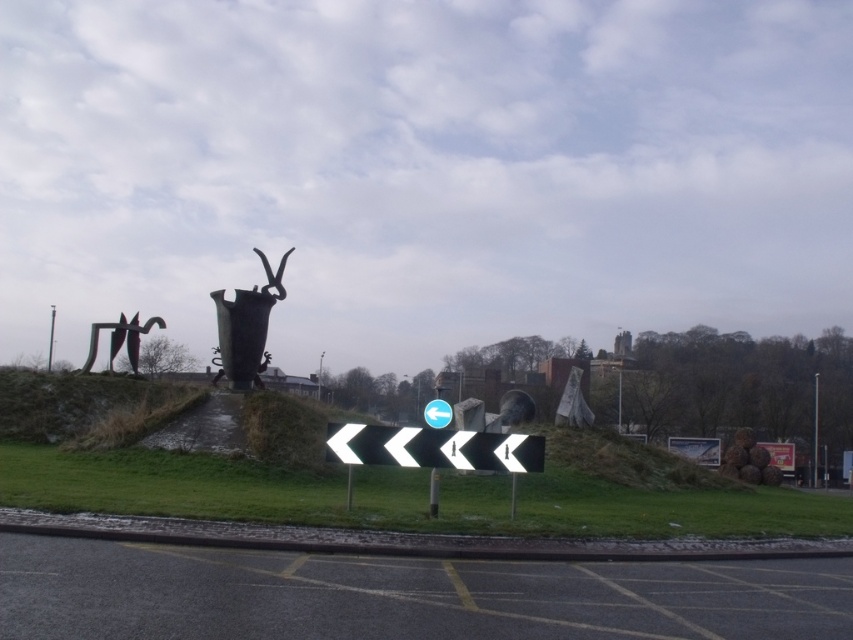
Question: Considering the real-world distances, which object is closest to the metallic pole at left?

Choices:
 (A) polished bronze vase at center
 (B) polished bronze statue at center

Answer: (A)

Question: Can you confirm if white plastic arrow at center is thinner than metallic pole at left?

Choices:
 (A) no
 (B) yes

Answer: (B)

Question: Which point is farther to the camera?

Choices:
 (A) (50, 321)
 (B) (88, 358)
 (C) (248, 369)

Answer: (A)

Question: Does polished bronze statue at center come in front of metallic pole at right?

Choices:
 (A) no
 (B) yes

Answer: (B)

Question: Among these objects, which one is nearest to the camera?

Choices:
 (A) metallic pole at left
 (B) metallic pole at right

Answer: (B)

Question: Does white plastic arrow at center have a smaller size compared to polished bronze sculpture at left?

Choices:
 (A) yes
 (B) no

Answer: (A)